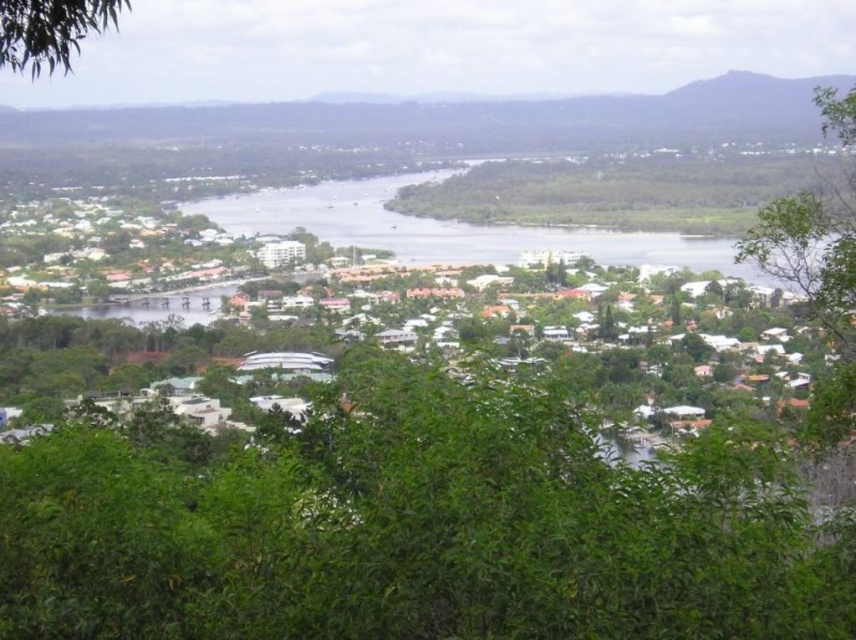
Can you confirm if green leafy tree at center is shorter than green leafy tree at upper left?

In fact, green leafy tree at center may be taller than green leafy tree at upper left.

Can you confirm if green leafy tree at center is taller than green leafy tree at upper left?

Correct, green leafy tree at center is much taller as green leafy tree at upper left.

What do you see at coordinates (417, 529) in the screenshot? The height and width of the screenshot is (640, 856). I see `green leafy tree at center` at bounding box center [417, 529].

Find the location of a particular element. This screenshot has height=640, width=856. green leafy tree at center is located at coordinates (417, 529).

Does green leafy tree at center appear on the right side of green leafy tree at right?

No, green leafy tree at center is not to the right of green leafy tree at right.

Can you confirm if green leafy tree at center is bigger than green leafy tree at right?

Yes, green leafy tree at center is bigger than green leafy tree at right.

Between point (684, 515) and point (840, 211), which one is positioned behind?

The point (840, 211) is behind.

The width and height of the screenshot is (856, 640). What are the coordinates of `green leafy tree at center` in the screenshot? It's located at (417, 529).

Between green leafy tree at right and green leafy tree at upper left, which one is positioned lower?

green leafy tree at right is below.

Does green leafy tree at right appear under green leafy tree at upper left?

Yes, green leafy tree at right is below green leafy tree at upper left.

Is point (835, 442) closer to camera compared to point (10, 29)?

No, (835, 442) is further to viewer.

Find the location of a particular element. This screenshot has width=856, height=640. green leafy tree at right is located at coordinates (816, 289).